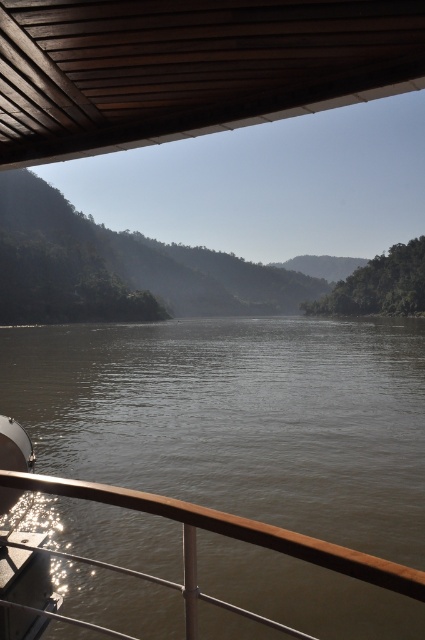
In the scene shown: You are standing on the boat and want to move to the brown wooden deck at upper center. Based on its 2D coordinates, where exactly should you look to find it?

The brown wooden deck at upper center is located at the 2D coordinates point (189, 67), so you should look towards the upper left portion of the scene to find it.